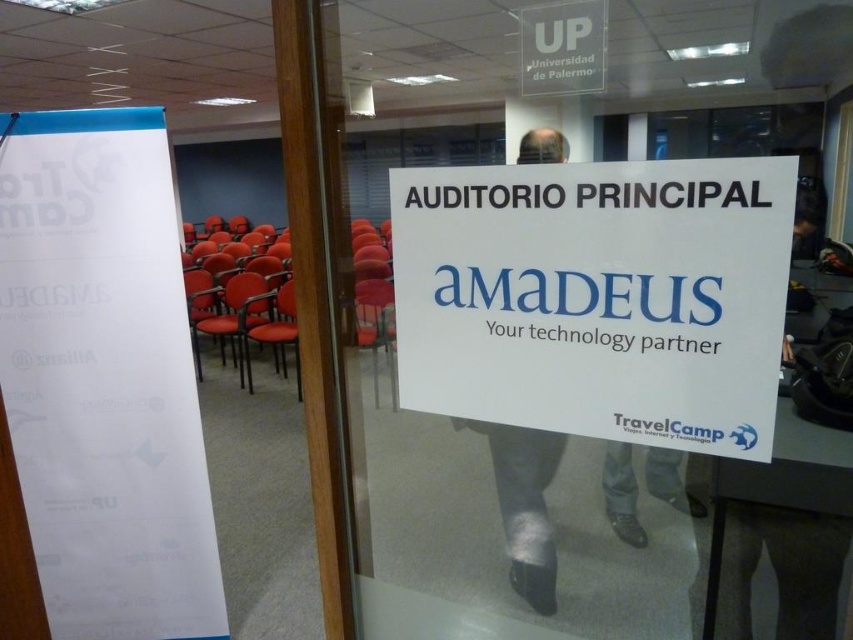
You are standing in the conference room and need to read the text on both the white paper sign at center and the white paper at left. Which one can you read more clearly?

The white paper sign at center can be read more clearly because it is closer to the viewer than the white paper at left.

You are a visitor at the Universidad de Palermo and need to enter the conference room. You see a transparent glass door at upper center and a matte orange chair at center. Which object is wider?

The transparent glass door at upper center is wider than the matte orange chair at center.